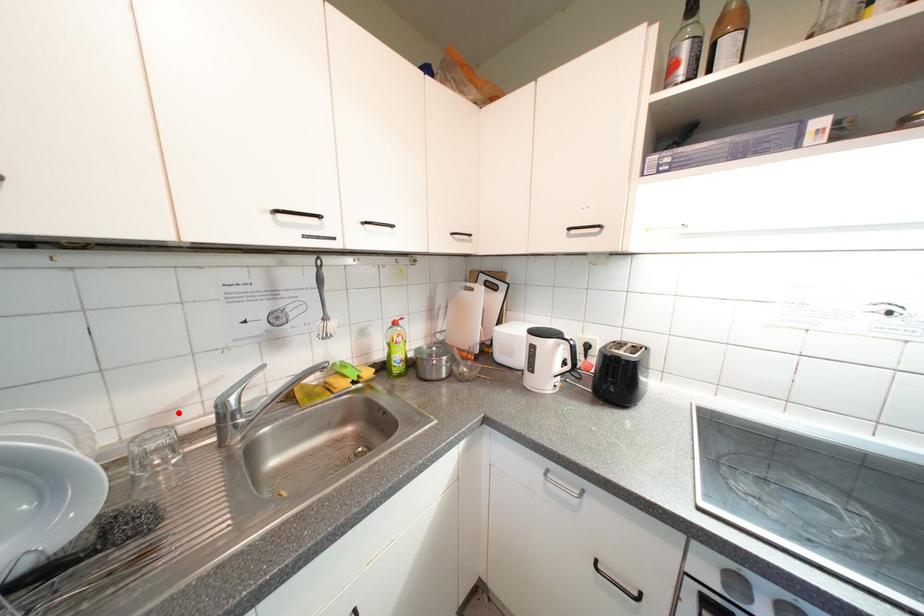
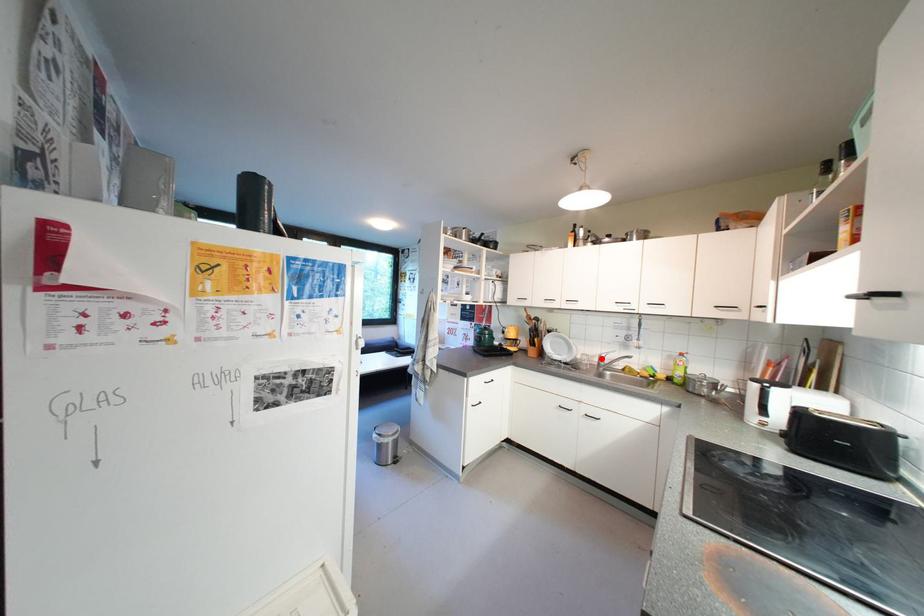
I am providing you with two images of the same scene from different viewpoints. A red point is marked on the first image and another point is marked on the second image. Is the red point in image1 aligned with the point shown in image2?

Yes